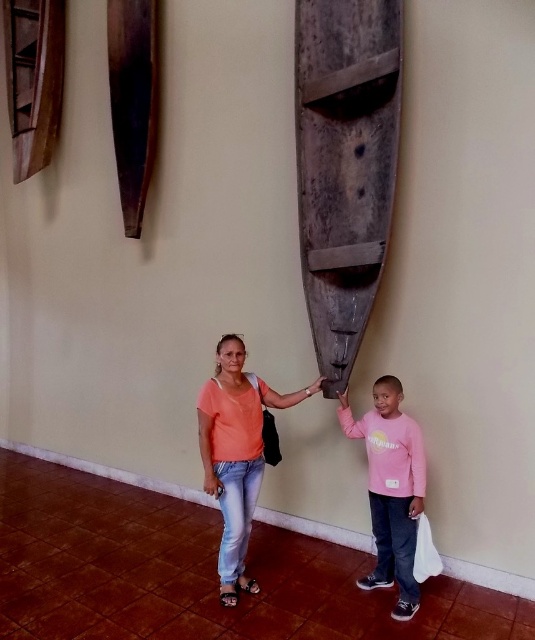
You are a tailor who needs to determine which shirt requires more fabric based on their sizes. Given that you see both the matte orange shirt at center and the pink cotton shirt at center, which one would need more fabric?

The matte orange shirt at center requires more fabric because its width is larger than the pink cotton shirt at center.